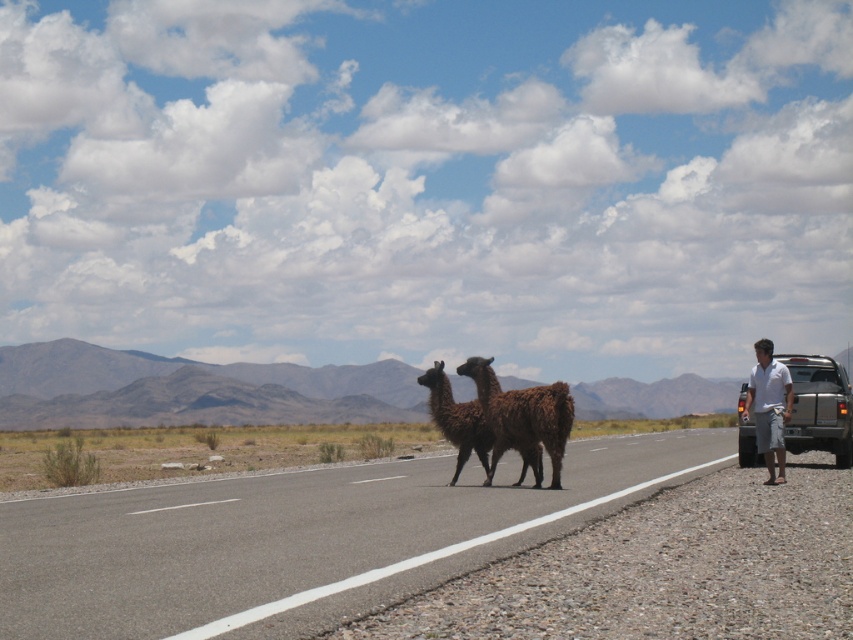
Does point (815, 422) come in front of point (761, 432)?

No.

Consider the image. Does silver metallic truck at right have a greater width compared to white cotton shirt at right?

Yes.

The image size is (853, 640). I want to click on silver metallic truck at right, so click(x=819, y=406).

Where is `brown woolly alpaca at center`? The width and height of the screenshot is (853, 640). brown woolly alpaca at center is located at coordinates (523, 419).

Is brown woolly alpaca at center thinner than white cotton shirt at right?

Yes, brown woolly alpaca at center is thinner than white cotton shirt at right.

Where is `brown woolly alpaca at center`? This screenshot has height=640, width=853. brown woolly alpaca at center is located at coordinates (523, 419).

Can you confirm if asphalt road at center is positioned below silver metallic truck at right?

Yes.

Does asphalt road at center have a lesser width compared to silver metallic truck at right?

Incorrect, asphalt road at center's width is not less than silver metallic truck at right's.

Describe the element at coordinates (299, 540) in the screenshot. I see `asphalt road at center` at that location.

Find the location of a particular element. asphalt road at center is located at coordinates (299, 540).